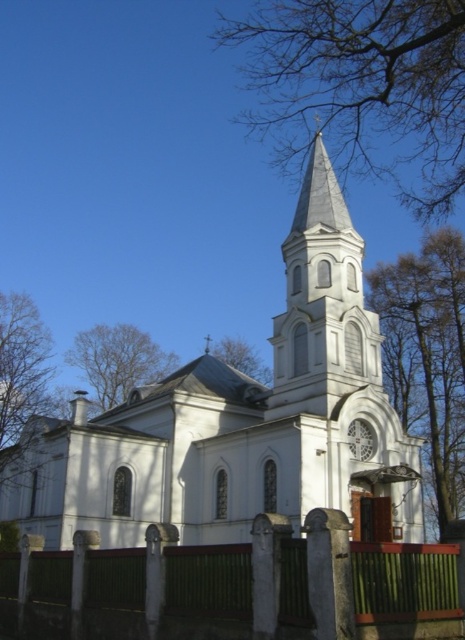
Question: From the image, what is the correct spatial relationship of green leafy tree at right in relation to bare branches at upper left?

Choices:
 (A) below
 (B) above

Answer: (A)

Question: Does bare branches at upper right appear over bare branches at upper left?

Choices:
 (A) yes
 (B) no

Answer: (A)

Question: Which point is farther to the camera?

Choices:
 (A) bare branches at upper right
 (B) green wooden fence at lower center
 (C) brown wood tree at left

Answer: (C)

Question: Which object appears closest to the camera in this image?

Choices:
 (A) green wooden fence at lower center
 (B) brown wood tree at left
 (C) bare branches at upper right
 (D) green leafy tree at right

Answer: (A)

Question: Does white smooth church at center have a larger size compared to bare branches at upper right?

Choices:
 (A) no
 (B) yes

Answer: (A)

Question: Based on their relative distances, which object is farther from the bare branches at upper left?

Choices:
 (A) bare branches at upper right
 (B) green leafy tree at upper center
 (C) white smooth church at center
 (D) green leafy tree at right

Answer: (A)